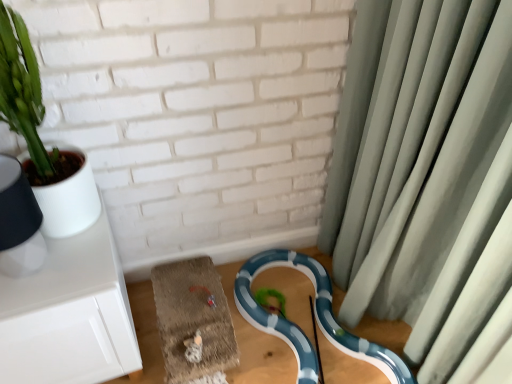
Question: From a real-world perspective, is green matte plant at upper left above or below green fabric curtain at right?

Choices:
 (A) above
 (B) below

Answer: (A)

Question: Is green matte plant at upper left situated inside green fabric curtain at right or outside?

Choices:
 (A) outside
 (B) inside

Answer: (A)

Question: Which object is the farthest from the green matte plant at upper left?

Choices:
 (A) blue glossy snake at lower center
 (B) green fabric curtain at right

Answer: (B)

Question: Which is farther from the green matte plant at upper left?

Choices:
 (A) green fabric curtain at right
 (B) blue glossy snake at lower center

Answer: (A)